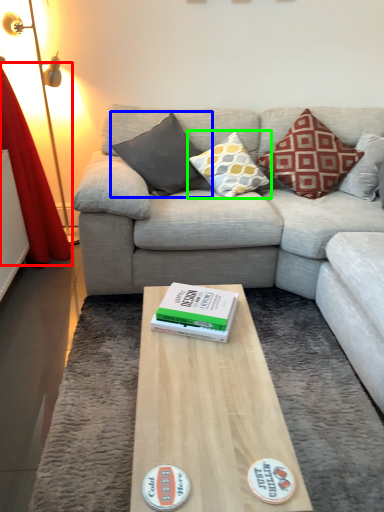
Question: Estimate the real-world distances between objects in this image. Which object is closer to curtain (highlighted by a red box), pillow (highlighted by a blue box) or pillow (highlighted by a green box)?

Choices:
 (A) pillow
 (B) pillow

Answer: (A)